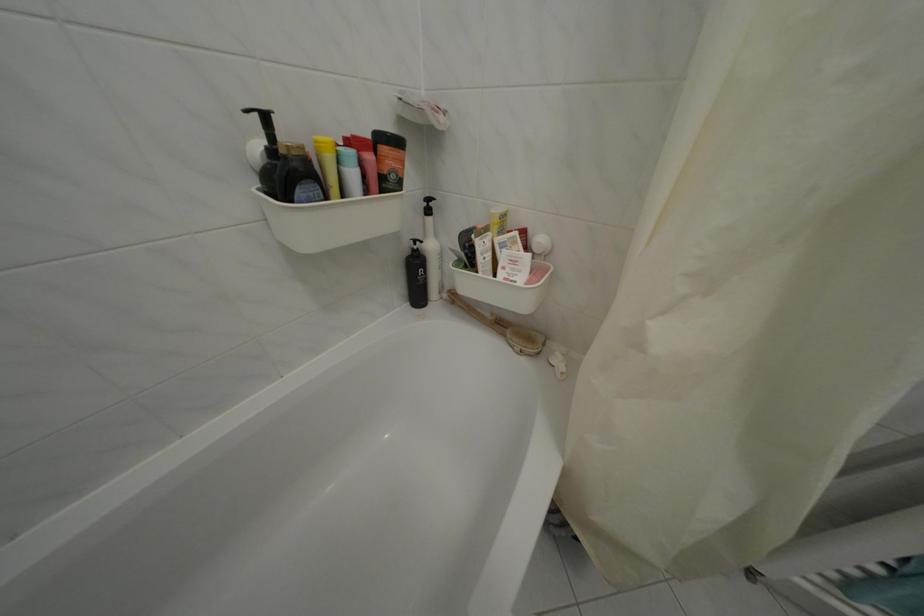
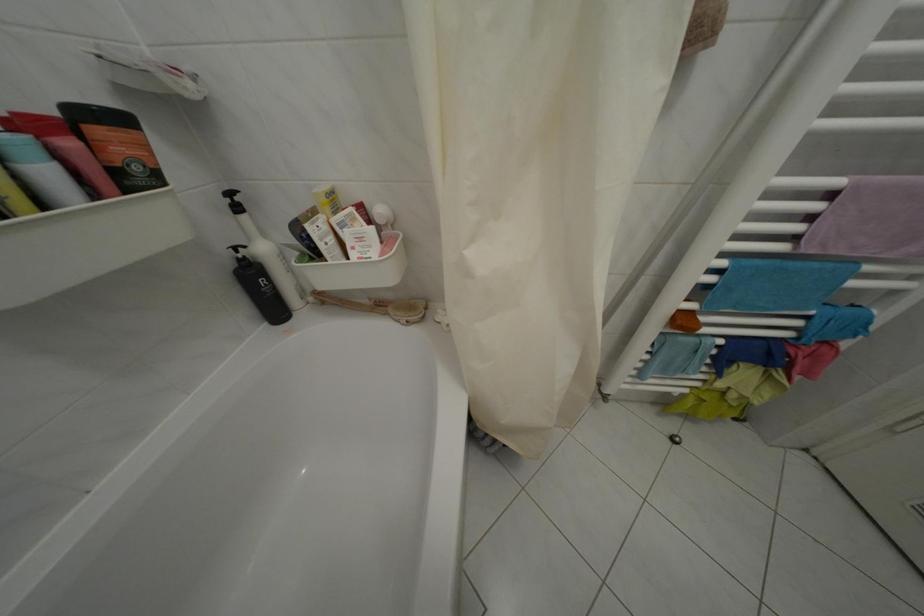
In the second image, find the point that corresponds to pixel 424 254 in the first image.

(249, 262)